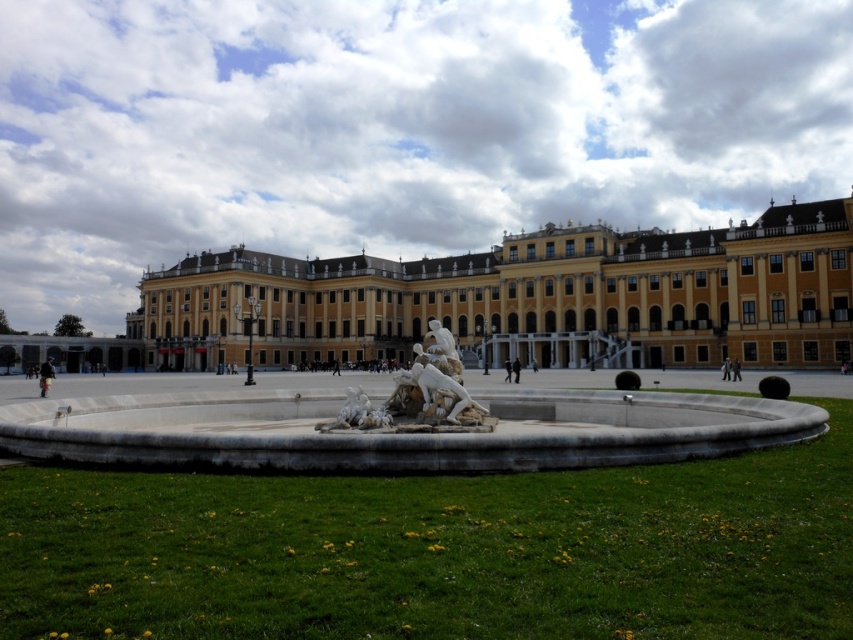
Question: Can you confirm if white marble fountain at center is wider than white marble sculpture at center?

Choices:
 (A) yes
 (B) no

Answer: (A)

Question: Which of these objects is positioned farthest from the white marble sculpture at center?

Choices:
 (A) yellow stone palace at center
 (B) white marble fountain at center

Answer: (A)

Question: Which object is positioned farthest from the white marble sculpture at center?

Choices:
 (A) yellow stone palace at center
 (B) white marble fountain at center

Answer: (A)

Question: Which point is closer to the camera?

Choices:
 (A) (190, 397)
 (B) (399, 275)

Answer: (A)

Question: Does yellow stone palace at center have a larger size compared to white marble sculpture at center?

Choices:
 (A) no
 (B) yes

Answer: (B)

Question: Does yellow stone palace at center appear on the left side of white marble sculpture at center?

Choices:
 (A) no
 (B) yes

Answer: (B)